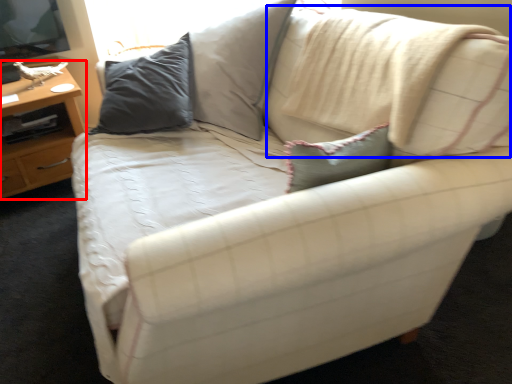
Question: Among these objects, which one is nearest to the camera, table (highlighted by a red box) or pillow (highlighted by a blue box)?

Choices:
 (A) table
 (B) pillow

Answer: (B)